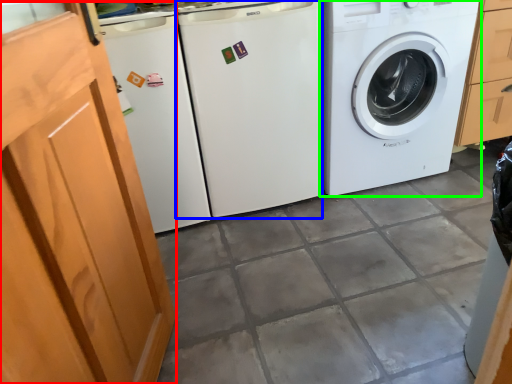
Question: Estimate the real-world distances between objects in this image. Which object is farther from screen door (highlighted by a red box), washing machine (highlighted by a blue box) or washing machine (highlighted by a green box)?

Choices:
 (A) washing machine
 (B) washing machine

Answer: (B)